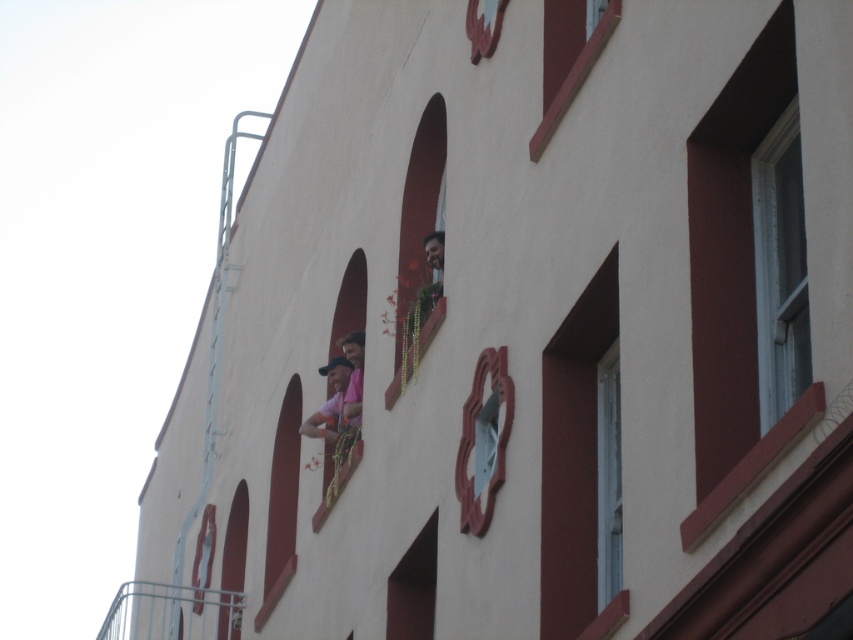
Does point (613, 547) come closer to viewer compared to point (320, 433)?

Yes, point (613, 547) is in front of point (320, 433).

Identify the location of metallic glass window at right. This screenshot has width=853, height=640. (608, 477).

The width and height of the screenshot is (853, 640). I want to click on metallic glass window at right, so click(x=608, y=477).

Is clear glass window at upper right bigger than smooth red window at center?

Indeed, clear glass window at upper right has a larger size compared to smooth red window at center.

In the scene shown: Who is more distant from viewer, (764, 340) or (267, 580)?

Point (267, 580)

Identify the location of clear glass window at upper right. (780, 268).

Which is behind, point (776, 380) or point (618, 344)?

Point (618, 344)

Is clear glass window at upper right further to camera compared to metallic glass window at right?

No, it is not.

The height and width of the screenshot is (640, 853). What do you see at coordinates (780, 268) in the screenshot?
I see `clear glass window at upper right` at bounding box center [780, 268].

I want to click on clear glass window at upper right, so click(780, 268).